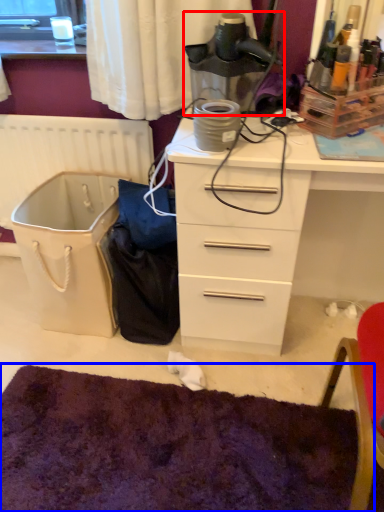
Question: Which object is closer to the camera taking this photo, appliance (highlighted by a red box) or mat (highlighted by a blue box)?

Choices:
 (A) appliance
 (B) mat

Answer: (B)